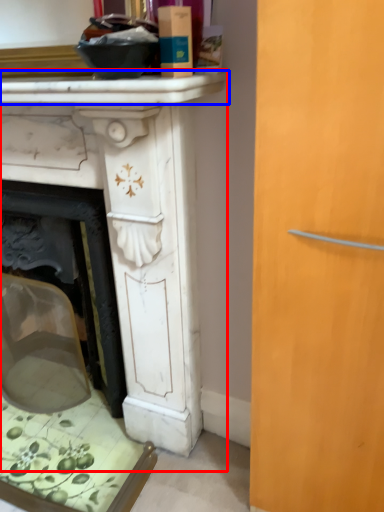
Question: Among these objects, which one is farthest to the camera, table (highlighted by a red box) or counter top (highlighted by a blue box)?

Choices:
 (A) table
 (B) counter top

Answer: (A)